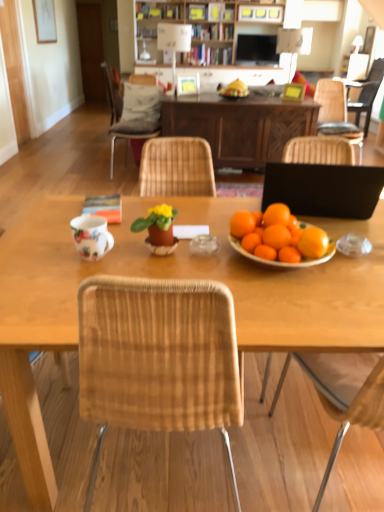
What are the coordinates of `vacant area that lies to the right of matte white picture frame at center, the second picture frame from the back` in the screenshot? It's located at (210, 93).